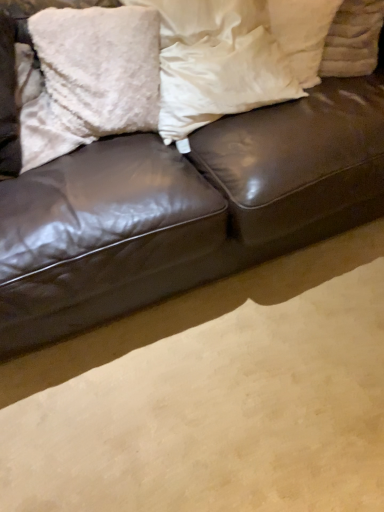
Question: From a real-world perspective, is fluffy white pillow at upper left, which ranks as the 3th pillow in right-to-left order, above or below white soft pillow at center, the second pillow in the right-to-left sequence?

Choices:
 (A) above
 (B) below

Answer: (B)

Question: Do you think fluffy white pillow at upper left, which ranks as the 3th pillow in right-to-left order, is within white soft pillow at center, the second pillow in the right-to-left sequence, or outside of it?

Choices:
 (A) inside
 (B) outside

Answer: (B)

Question: Which is nearer to the white soft pillow at center, the 2th pillow viewed from the left?

Choices:
 (A) shiny brown leather couch at center
 (B) white fluffy pillow at upper right, which is the 1th pillow in right-to-left order
 (C) fluffy white pillow at upper left, which ranks as the 3th pillow in right-to-left order

Answer: (C)

Question: Estimate the real-world distances between objects in this image. Which object is closer to the white fluffy pillow at upper right, which is the 1th pillow in right-to-left order?

Choices:
 (A) fluffy white pillow at upper left, arranged as the first pillow when viewed from the left
 (B) white soft pillow at center, the second pillow in the right-to-left sequence
 (C) shiny brown leather couch at center

Answer: (B)